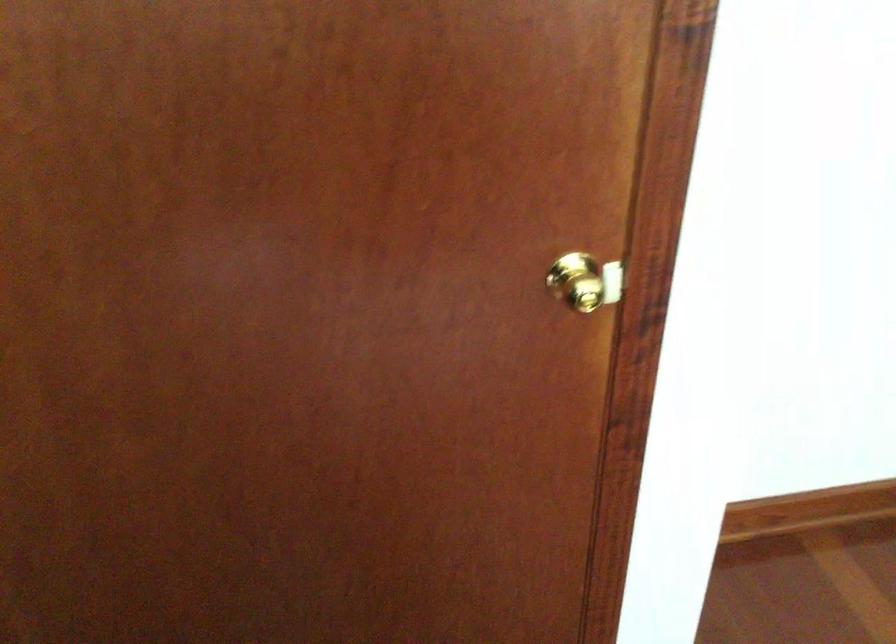
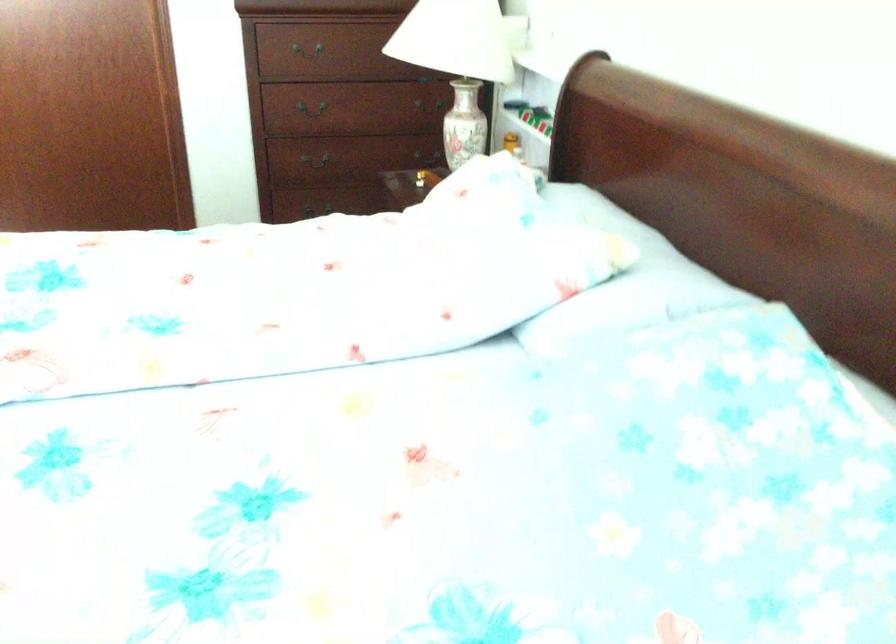
Which direction would the cameraman need to move to produce the second image?

The cameraman walked toward right, backward.